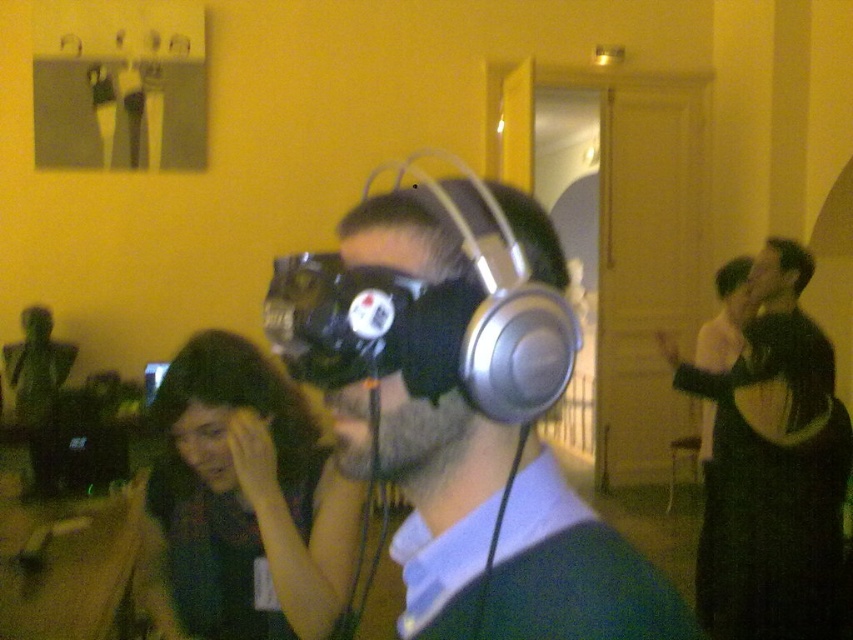
At what (x,y) coordinates should I click in order to perform the action: click on silver metallic headphones at center. Please return your answer as a coordinate pair (x, y). Looking at the image, I should click on (572, 570).

Between silver metallic headphones at center and black matte jacket at upper right, which one has less height?

With less height is silver metallic headphones at center.

Find the location of `silver metallic headphones at center`. silver metallic headphones at center is located at coordinates (572, 570).